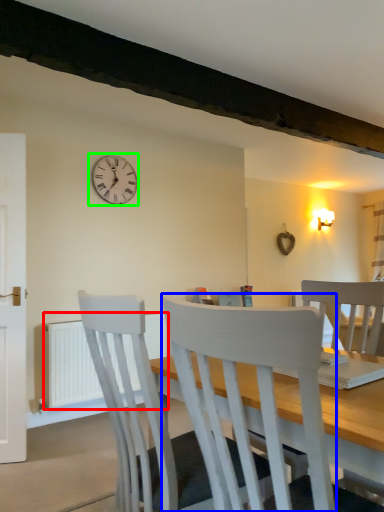
Question: Which is nearer to the radiator (highlighted by a red box)? chair (highlighted by a blue box) or wall clock (highlighted by a green box).

Choices:
 (A) chair
 (B) wall clock

Answer: (B)